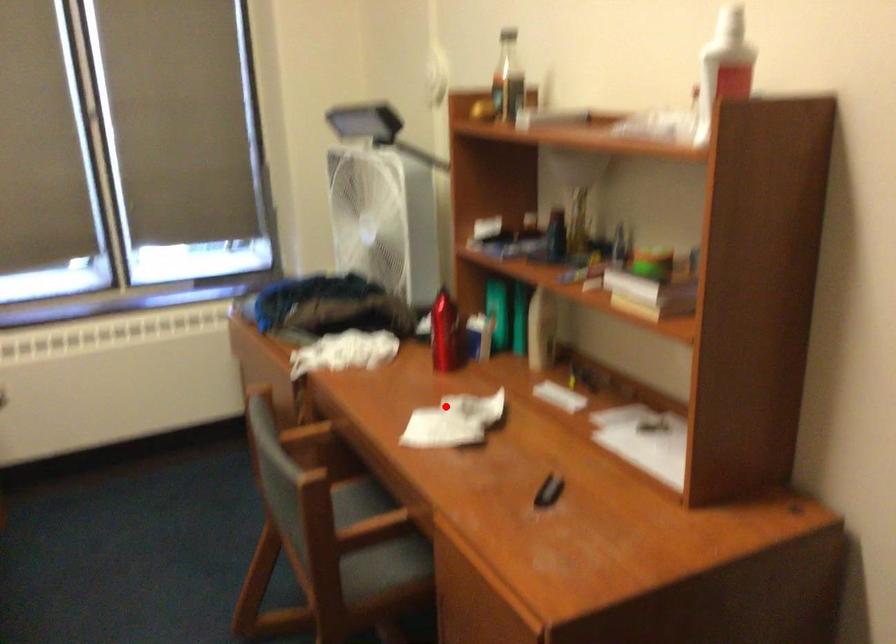
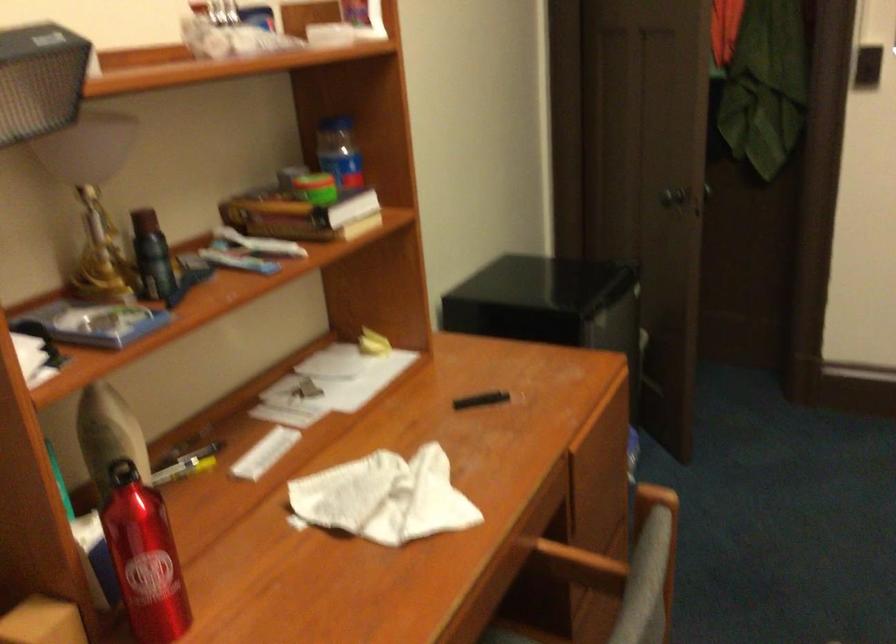
Where in the second image is the point corresponding to the highlighted location from the first image?

(383, 498)